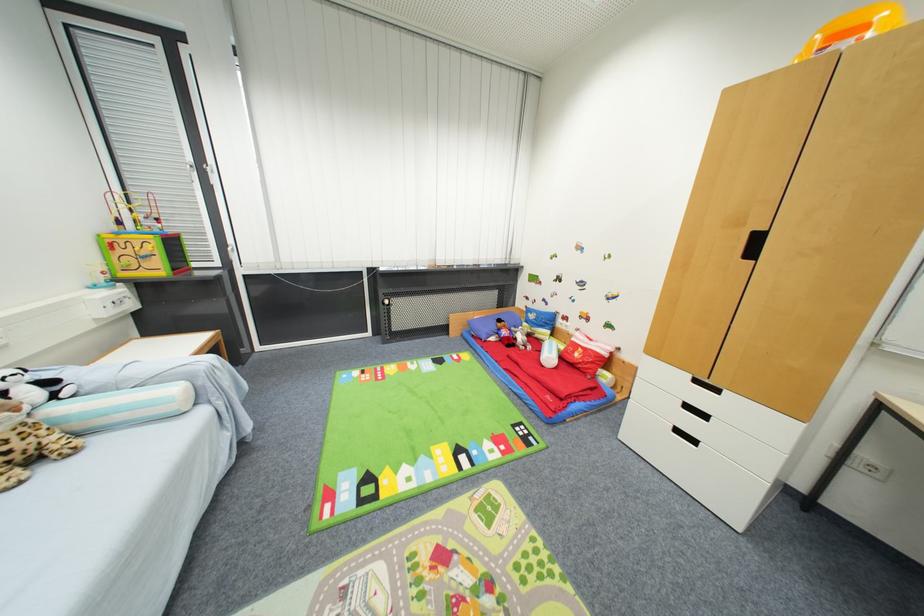
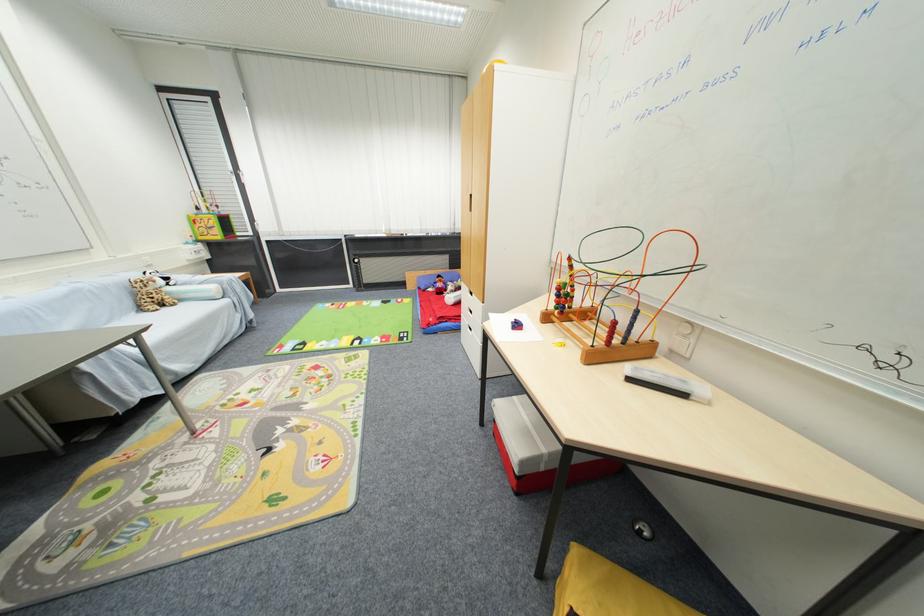
Question: I am providing you with two images of the same scene from different viewpoints. After the viewpoint changes to image2, which objects are now occluded?

Choices:
 (A) black cabinet handle
 (B) white drawer handle
 (C) whiteboard eraser
 (D) coffee maker lid

Answer: (A)